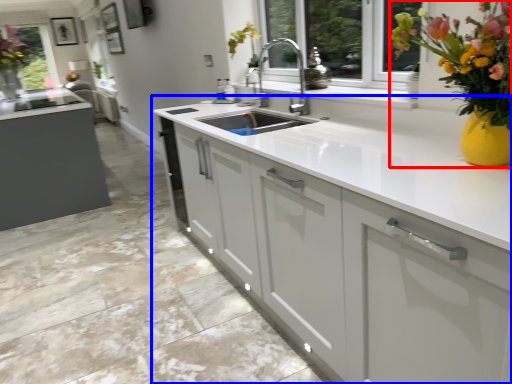
Question: Which object is further to the camera taking this photo, floral arrangement (highlighted by a red box) or cabinetry (highlighted by a blue box)?

Choices:
 (A) floral arrangement
 (B) cabinetry

Answer: (B)